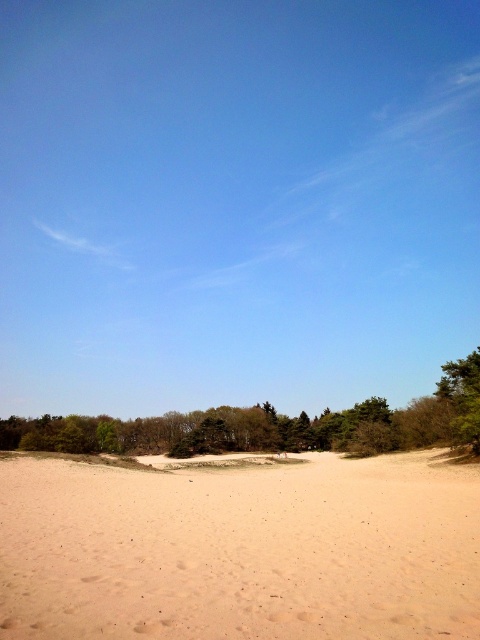
You are standing on the sandy terrain and want to walk to both the point at coordinates point (241,612) and point (176,413). Which point will you reach first if you start walking towards them from your current position?

You will reach point (241,612) first because it is closer to you than point (176,413).

You are standing on the light brown sandy at center and want to walk to the green leafy tree at lower left. Which direction should you face to walk directly towards it?

You should face the lower left direction to walk directly towards the green leafy tree at lower left from the light brown sandy at center.

You are planning to set up a small tent for a picnic. You have two options for the location. One is on the light brown sandy at center and the other is near the green leafy tree at lower left. Considering the size of the objects, which location would provide more space for your tent?

The green leafy tree at lower left is larger than the light brown sandy at center, so setting up the tent near the green leafy tree at lower left would provide more space.